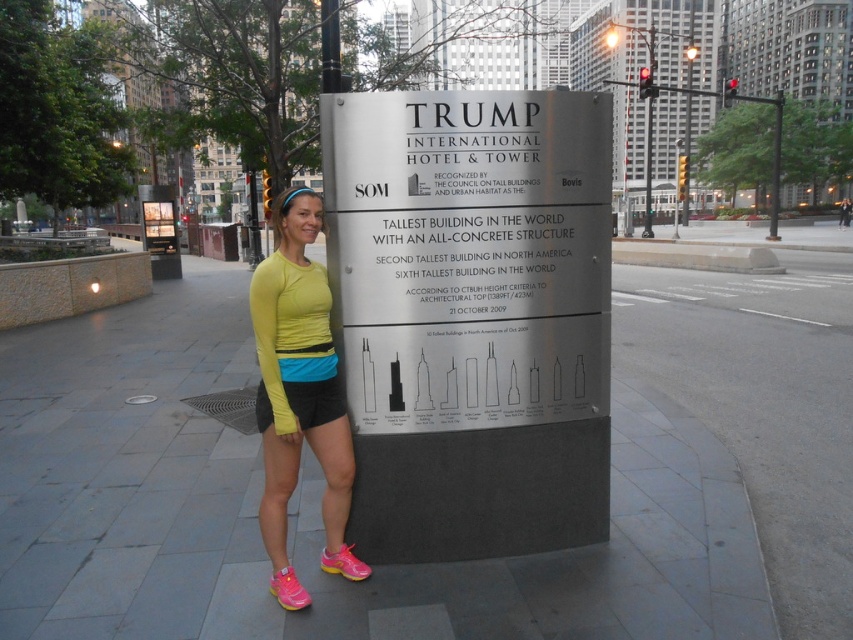
You are a delivery person who needs to attach a package to the tallest object between the silver metallic sign at center and the metallic pole at upper center. Which object should you choose?

The metallic pole at upper center is taller than the silver metallic sign at center, so you should attach the package to the metallic pole at upper center.